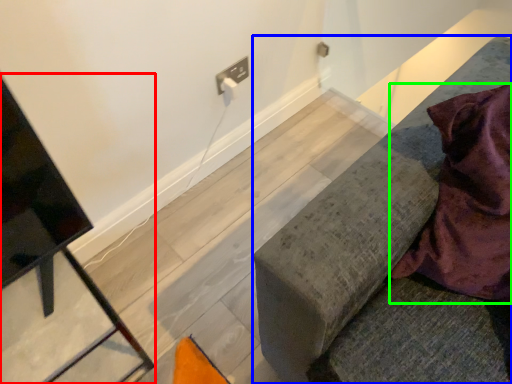
Question: Estimate the real-world distances between objects in this image. Which object is closer to furniture (highlighted by a red box), furniture (highlighted by a blue box) or blanket (highlighted by a green box)?

Choices:
 (A) furniture
 (B) blanket

Answer: (A)